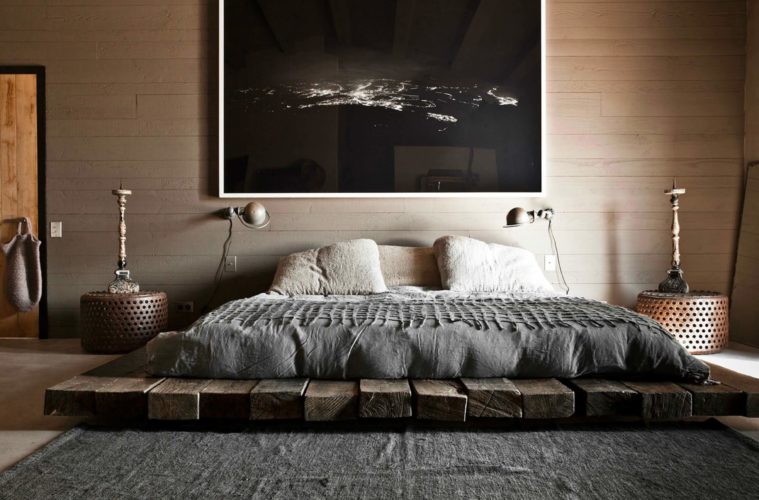
You are a GUI agent. You are given a task and a screenshot of the screen. Output one action in this format:
    pyautogui.click(x=<x>, y=<y>)
    Task: Click on the stand
    
    Given the screenshot: What is the action you would take?
    pyautogui.click(x=690, y=313)